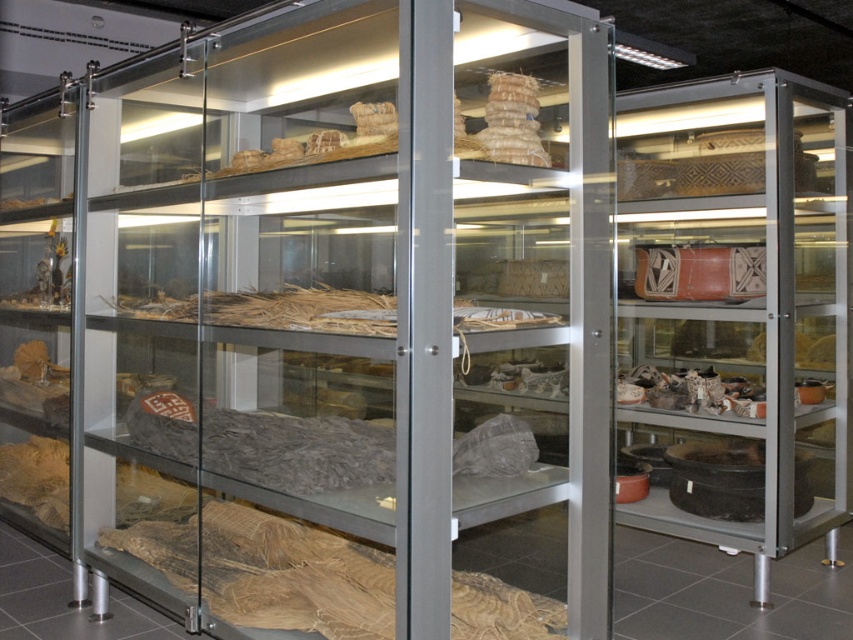
Looking at this image, does clear glass shelf at center appear over matte ceramic bowls at right?

Correct, clear glass shelf at center is located above matte ceramic bowls at right.

In order to click on clear glass shelf at center in this screenshot , I will do `click(367, 324)`.

Is matte brown fabric at left below brown straw mat at center?

No.

Does matte brown fabric at left come behind brown straw mat at center?

Yes, matte brown fabric at left is further from the viewer.

At what (x,y) coordinates should I click in order to perform the action: click on matte brown fabric at left. Please return your answer as a coordinate pair (x, y). This screenshot has width=853, height=640. Looking at the image, I should click on (44, 320).

The width and height of the screenshot is (853, 640). Find the location of `matte brown fabric at left`. matte brown fabric at left is located at coordinates (44, 320).

Is matte ceramic bowls at right closer to camera compared to brown textured fabric at lower left?

No, matte ceramic bowls at right is behind brown textured fabric at lower left.

Is point (732, 186) positioned before point (51, 490)?

That is True.

The height and width of the screenshot is (640, 853). What do you see at coordinates (735, 310) in the screenshot?
I see `matte ceramic bowls at right` at bounding box center [735, 310].

Find the location of a particular element. The width and height of the screenshot is (853, 640). matte ceramic bowls at right is located at coordinates (735, 310).